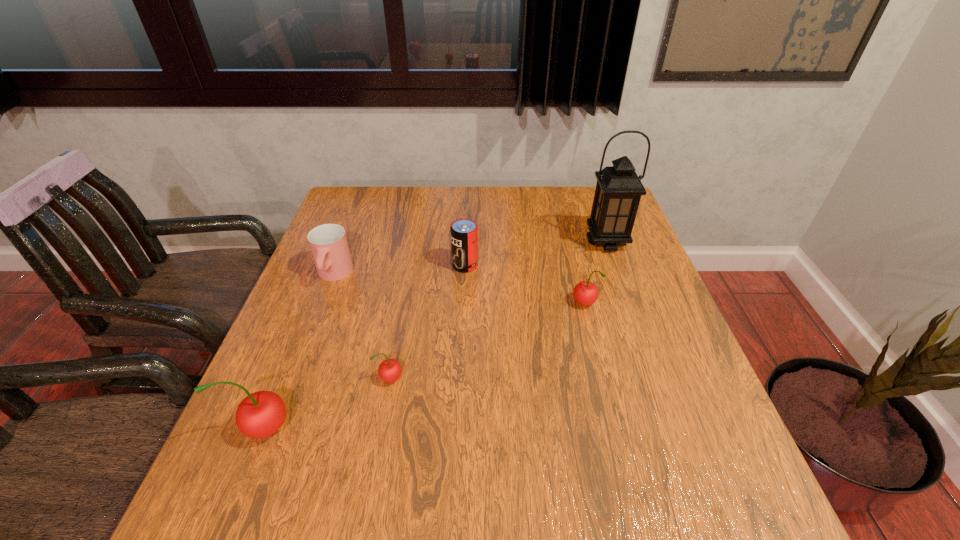
You are a GUI agent. You are given a task and a screenshot of the screen. Output one action in this format:
    pyautogui.click(x=<x>, y=<y>)
    Task: Click on the free space between the farthest object and the can
    The height and width of the screenshot is (540, 960).
    Given the screenshot: What is the action you would take?
    pyautogui.click(x=536, y=254)

At what (x,y) coordinates should I click in order to perform the action: click on unoccupied position between the shortest object and the cup. Please return your answer as a coordinate pair (x, y). Looking at the image, I should click on (362, 327).

This screenshot has width=960, height=540. I want to click on free spot between the cup and the can, so click(399, 270).

You are a GUI agent. You are given a task and a screenshot of the screen. Output one action in this format:
    pyautogui.click(x=<x>, y=<y>)
    Task: Click on the free space that is in between the nearest cherry and the cup
    The height and width of the screenshot is (540, 960).
    Given the screenshot: What is the action you would take?
    pyautogui.click(x=300, y=352)

I want to click on unoccupied position between the tallest object and the can, so click(536, 254).

Identify the location of vacant area between the can and the nearest object. (365, 347).

Where is `object that ranks as the second closest to the third object from right to left`? object that ranks as the second closest to the third object from right to left is located at coordinates click(x=328, y=242).

Where is `the second closest object to the cup`? The image size is (960, 540). the second closest object to the cup is located at coordinates (389, 370).

Locate an element on the screen. This screenshot has width=960, height=540. cherry object that ranks as the closest to the cup is located at coordinates (389, 370).

At what (x,y) coordinates should I click in order to perform the action: click on cherry that is the second closest to the second shortest cherry. Please return your answer as a coordinate pair (x, y). Looking at the image, I should click on (261, 414).